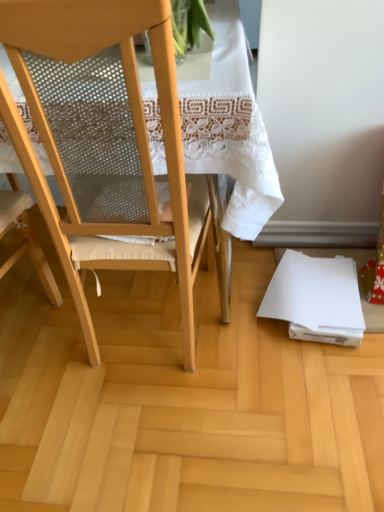
At what (x,y) coordinates should I click in order to perform the action: click on vacant space that is to the left of white paper at lower right. Please return your answer as a coordinate pair (x, y). The height and width of the screenshot is (512, 384). Looking at the image, I should click on (222, 317).